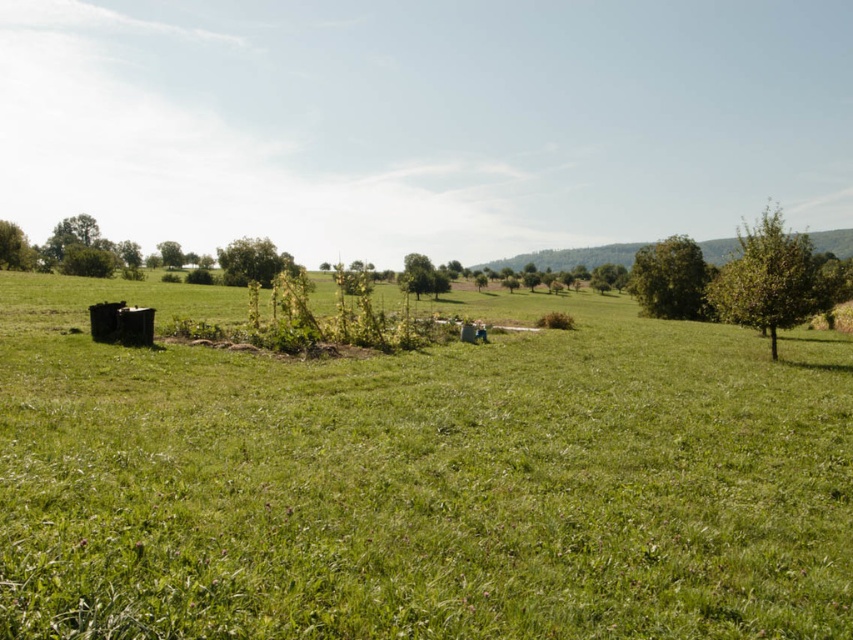
Describe the element at coordinates (770, 280) in the screenshot. I see `green leafy tree at right` at that location.

Consider the image. Can you confirm if green leafy tree at right is positioned to the right of green leafy tree at center?

Indeed, green leafy tree at right is positioned on the right side of green leafy tree at center.

Is point (720, 285) behind point (277, 266)?

No, it is in front of (277, 266).

Where is `green leafy tree at right`? This screenshot has height=640, width=853. green leafy tree at right is located at coordinates (770, 280).

Consider the image. Which is above, green grass pasture at center or green leafy tree at upper right?

green leafy tree at upper right

Who is taller, green grass pasture at center or green leafy tree at upper right?

With more height is green leafy tree at upper right.

Who is more forward, [108,499] or [643,278]?

Point [108,499] is in front.

Find the location of a particular element. green grass pasture at center is located at coordinates (421, 480).

Who is positioned more to the right, green leafy tree at center or green leafy tree at left?

green leafy tree at center

Between green leafy tree at center and green leafy tree at left, which one has less height?

green leafy tree at center

At what (x,y) coordinates should I click in order to perform the action: click on green leafy tree at center. Please return your answer as a coordinate pair (x, y). This screenshot has width=853, height=640. Looking at the image, I should click on (252, 260).